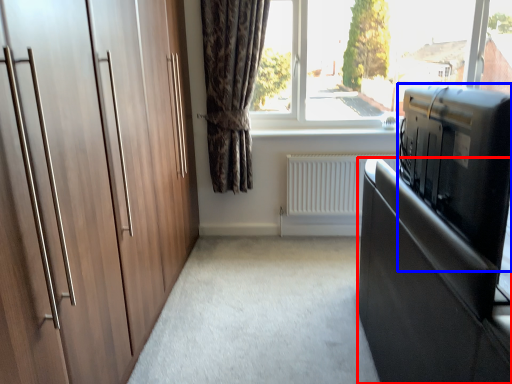
Question: Which point is further to the camera, cabinetry (highlighted by a red box) or appliance (highlighted by a blue box)?

Choices:
 (A) cabinetry
 (B) appliance

Answer: (B)